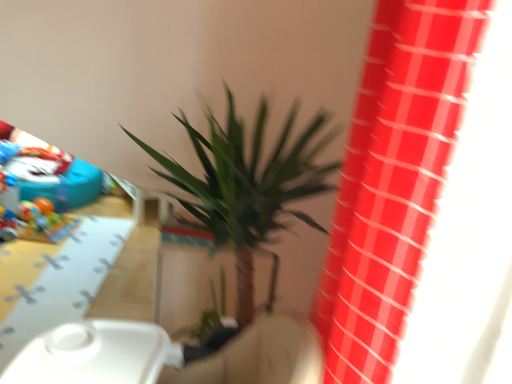
Question: From a real-world perspective, is green leafy plant at center physically located above or below glossy plastic curtain at upper right?

Choices:
 (A) above
 (B) below

Answer: (B)

Question: From the image's perspective, is green leafy plant at center located above or below glossy plastic curtain at upper right?

Choices:
 (A) below
 (B) above

Answer: (A)

Question: Which object is the closest to the green leafy plant at center?

Choices:
 (A) yellow matte table at lower left
 (B) glossy plastic curtain at upper right

Answer: (B)

Question: Estimate the real-world distances between objects in this image. Which object is farther from the green leafy plant at center?

Choices:
 (A) yellow matte table at lower left
 (B) glossy plastic curtain at upper right

Answer: (A)